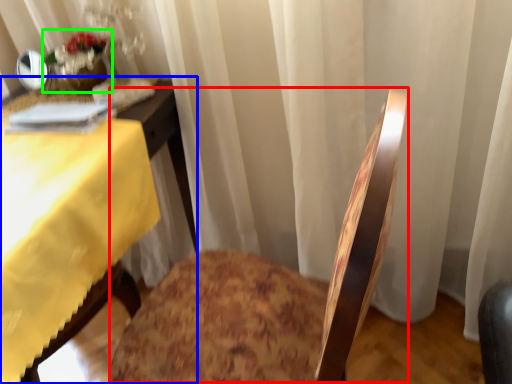
Question: Which object is the closest to the rocking chair (highlighted by a red box)? Choose among these: table (highlighted by a blue box) or floral arrangement (highlighted by a green box).

Choices:
 (A) table
 (B) floral arrangement

Answer: (A)